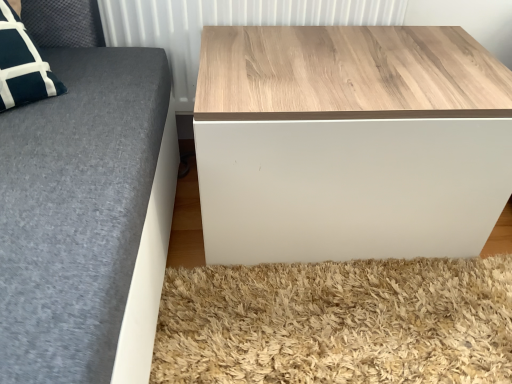
What do you see at coordinates (349, 142) in the screenshot?
I see `wooden table at lower right` at bounding box center [349, 142].

In order to face wooden table at lower right, should I rotate leftwards or rightwards?

Rotate your view right by about 10.938°.

This screenshot has width=512, height=384. I want to click on wooden table at lower right, so click(x=349, y=142).

What are the coordinates of `wooden panel at upper center` in the screenshot? It's located at (224, 25).

What do you see at coordinates (224, 25) in the screenshot?
I see `wooden panel at upper center` at bounding box center [224, 25].

This screenshot has height=384, width=512. I want to click on wooden table at lower right, so [349, 142].

Does wooden panel at upper center appear on the right side of wooden table at lower right?

In fact, wooden panel at upper center is to the left of wooden table at lower right.

Is wooden panel at upper center in front of or behind wooden table at lower right in the image?

Visually, wooden panel at upper center is located behind wooden table at lower right.

Is point (318, 1) behind point (285, 234)?

Yes, point (318, 1) is behind point (285, 234).

From the image's perspective, which is above, wooden panel at upper center or wooden table at lower right?

wooden panel at upper center appears higher in the image.

From a real-world perspective, which object stands above the other?

wooden panel at upper center.

Considering the relative sizes of wooden panel at upper center and wooden table at lower right in the image provided, is wooden panel at upper center wider than wooden table at lower right?

Incorrect, the width of wooden panel at upper center does not surpass that of wooden table at lower right.

From their relative heights in the image, would you say wooden panel at upper center is taller or shorter than wooden table at lower right?

wooden panel at upper center is shorter than wooden table at lower right.

Who is bigger, wooden panel at upper center or wooden table at lower right?

wooden table at lower right is bigger.

Could wooden table at lower right be considered to be inside wooden panel at upper center?

No.

Is wooden panel at upper center not near wooden table at lower right?

No.

Is wooden panel at upper center aimed at wooden table at lower right?

Yes, wooden panel at upper center is aimed at wooden table at lower right.

How far apart are wooden panel at upper center and wooden table at lower right?

wooden panel at upper center is 12.86 inches from wooden table at lower right.

Find the location of a particular element. radiator above the wooden table at lower right (from a real-world perspective) is located at coordinates (224, 25).

Between wooden table at lower right and wooden panel at upper center, which one appears on the right side from the viewer's perspective?

From the viewer's perspective, wooden table at lower right appears more on the right side.

Between wooden table at lower right and wooden panel at upper center, which one is positioned in front?

wooden table at lower right is in front.

Considering the points (208, 167) and (321, 19), which point is behind, point (208, 167) or point (321, 19)?

Point (321, 19)

From the image's perspective, which is above, wooden table at lower right or wooden panel at upper center?

From the image's view, wooden panel at upper center is above.

From a real-world perspective, which object stands above the other?

wooden panel at upper center is physically above.

Does wooden table at lower right have a greater width compared to wooden panel at upper center?

Correct, the width of wooden table at lower right exceeds that of wooden panel at upper center.

Is wooden table at lower right taller or shorter than wooden panel at upper center?

wooden table at lower right is taller than wooden panel at upper center.

Is wooden table at lower right smaller than wooden panel at upper center?

No.

Is wooden panel at upper center located within wooden table at lower right?

No, wooden panel at upper center is located outside of wooden table at lower right.

Is wooden table at lower right directly adjacent to wooden panel at upper center?

wooden table at lower right is not next to wooden panel at upper center, and they're not touching.

Could you tell me if wooden table at lower right is turned towards wooden panel at upper center?

No, wooden table at lower right is not oriented towards wooden panel at upper center.

In order to click on table lying below the wooden panel at upper center (from the image's perspective) in this screenshot , I will do `click(349, 142)`.

The width and height of the screenshot is (512, 384). In order to click on radiator above the wooden table at lower right (from the image's perspective) in this screenshot , I will do `click(224, 25)`.

The image size is (512, 384). In order to click on table in front of the wooden panel at upper center in this screenshot , I will do `click(349, 142)`.